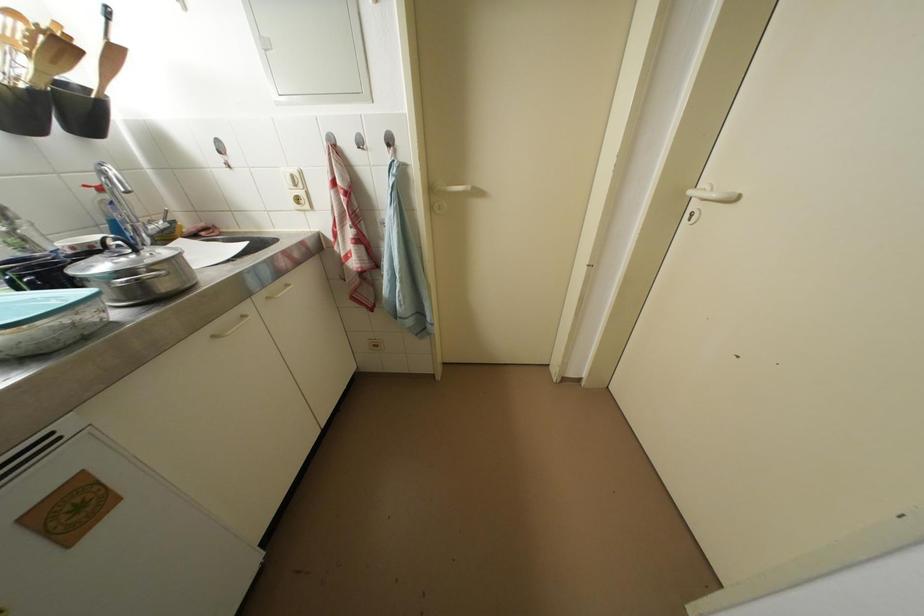
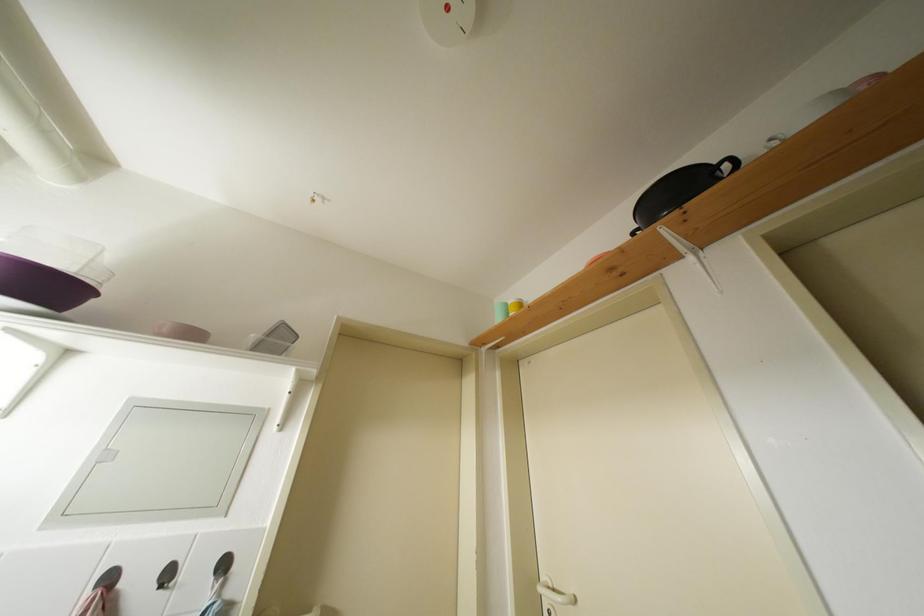
The first image is from the beginning of the video and the second image is from the end. How did the camera likely rotate when shooting the video?

The rotation direction of the camera is right-up.